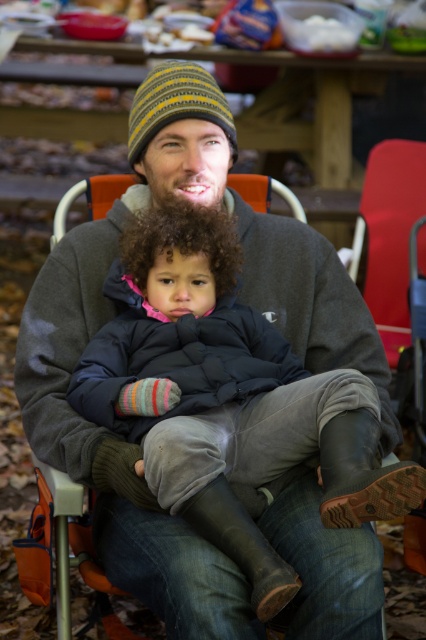
You are planning to bring both the red plastic chair at right and the yellow striped knit beanie at center into a small tent. Considering their sizes, which one might be more challenging to fit inside the tent?

The red plastic chair at right has a larger size compared to the yellow striped knit beanie at center, so it might be more challenging to fit inside the tent.

You are standing in the picnic area and see two points marked in the image. Which point is closer to you, point (400, 282) or point (187, 109)?

Point (400, 282) is further to the viewer than point (187, 109), so point (187, 109) is closer to you.